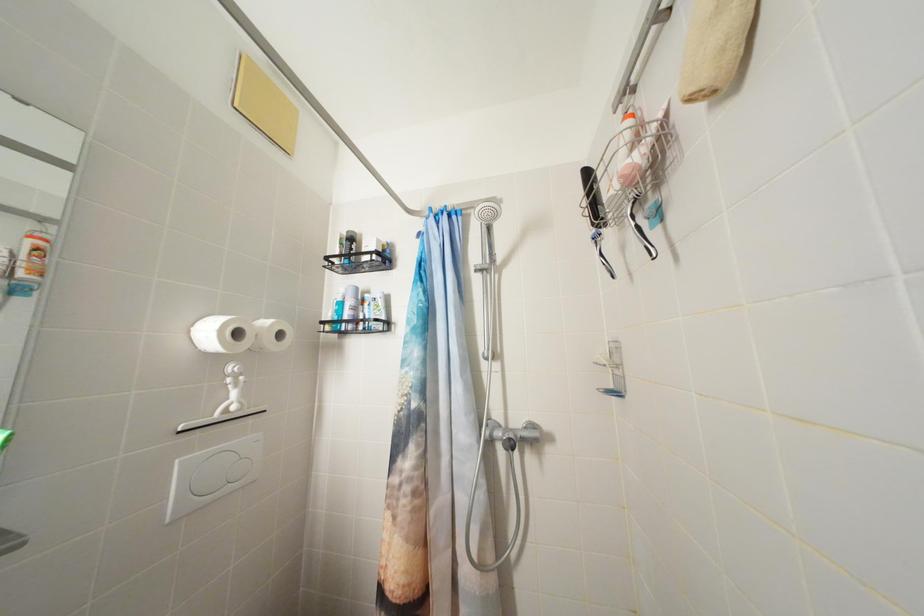
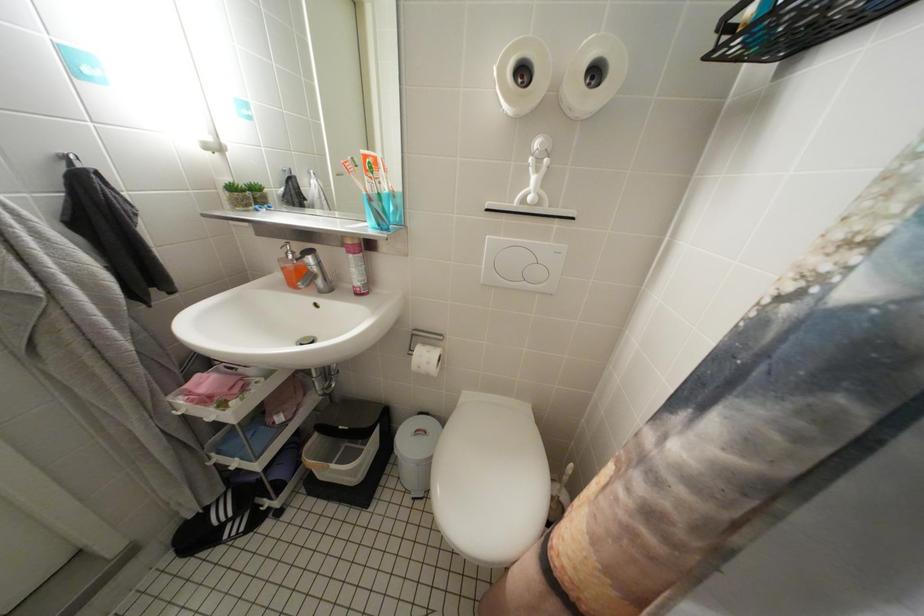
The images are taken continuously from a first-person perspective. In which direction is your viewpoint rotating?

The camera's rotation is toward left-down.